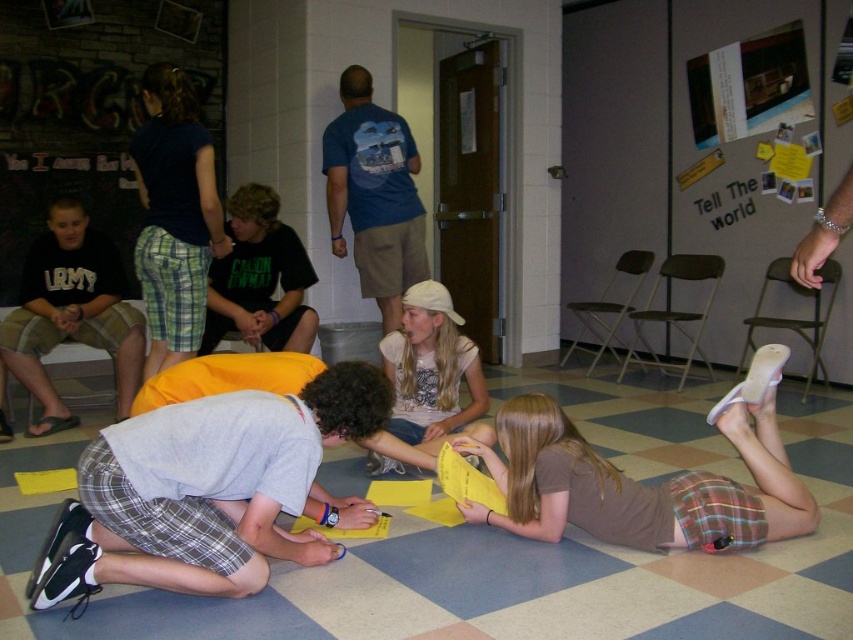
You are standing in the hallway and need to locate the army green shorts at left. According to the coordinates provided, where exactly would you find them in the image?

The army green shorts at left are located at point 0.491 on the x axis and 0.084 on the y axis.

From the picture: You are organizing a clothing donation drive and need to determine if the army green shorts at left and the white cotton shirt at center can fit into a standard donation box that has a maximum capacity of 0.5 cubic meters. Based on their sizes, will both items fit together?

The army green shorts at left is bigger than the white cotton shirt at center. However, without specific size measurements, it is impossible to determine if both items will fit into the donation box together.